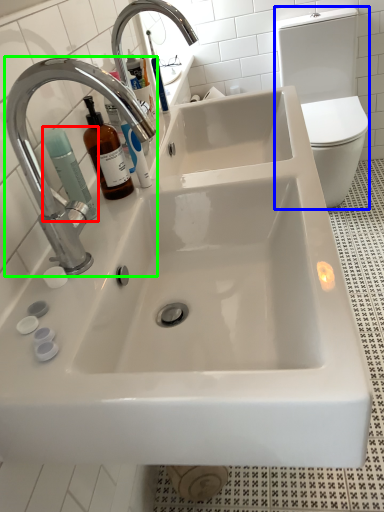
Question: Considering the real-world distances, which object is closest to cleaning product (highlighted by a red box)? toilet bowl (highlighted by a blue box) or tap (highlighted by a green box).

Choices:
 (A) toilet bowl
 (B) tap

Answer: (B)